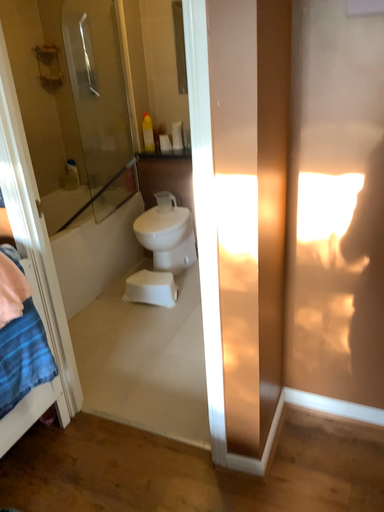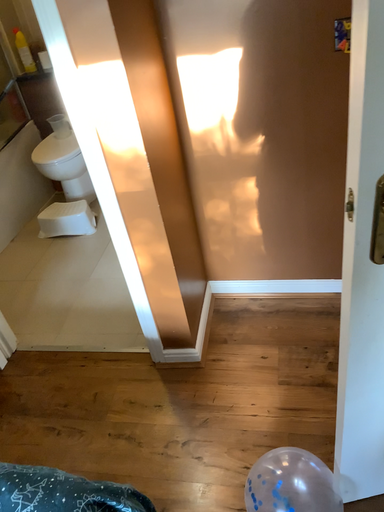
Question: Which way did the camera rotate in the video?

Choices:
 (A) rotated upward
 (B) rotated downward

Answer: (B)